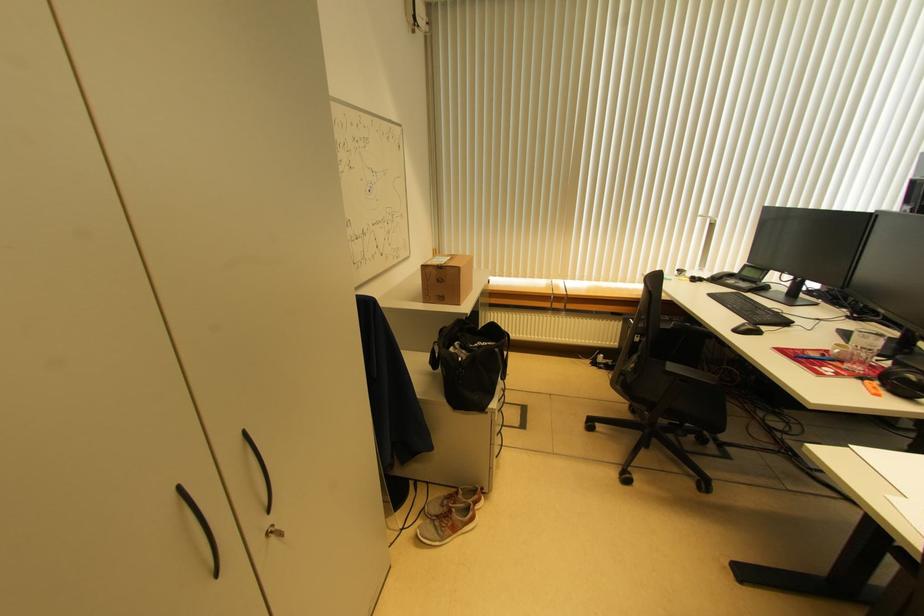
Find the location of `cardboard box`. cardboard box is located at coordinates (446, 278).